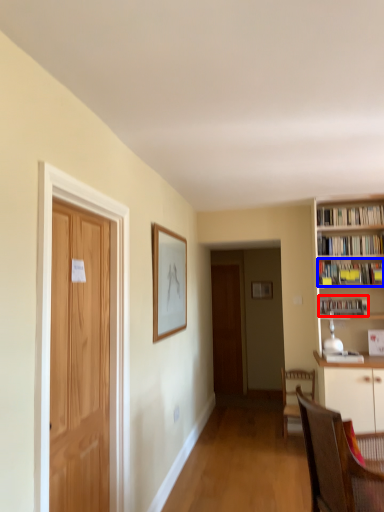
Question: Which object is closer to the camera taking this photo, book (highlighted by a red box) or book (highlighted by a blue box)?

Choices:
 (A) book
 (B) book

Answer: (B)